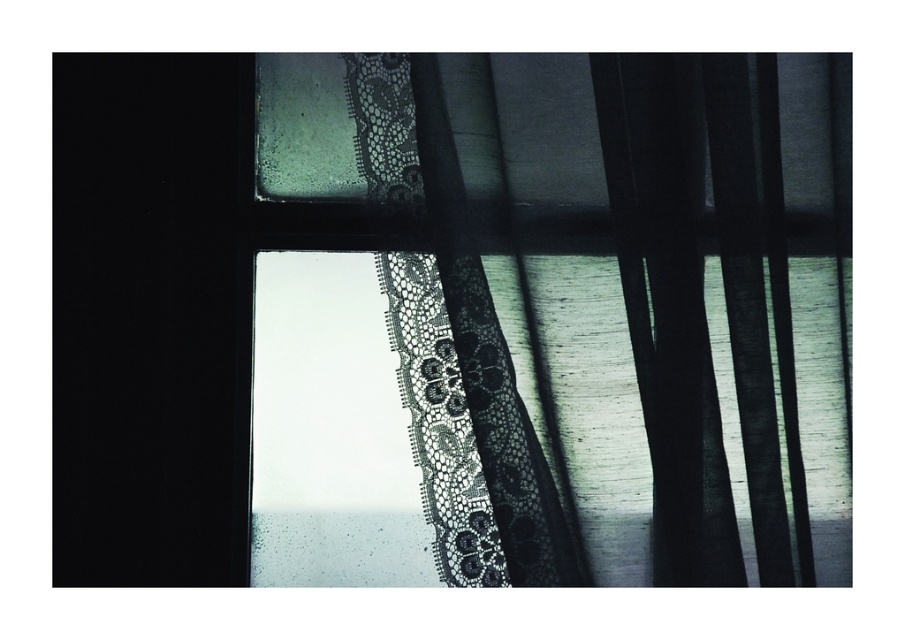
You are an interior designer planning to replace the black lace curtain at upper center and the black matte door at left with new items. If you want to maintain the balance of the room, which object should you choose to make larger? Please consider their current sizes as described.

The black lace curtain at upper center is larger in size than the black matte door at left. To maintain balance, you should make the black matte door at left larger to match the scale of the black lace curtain at upper center.

You are an interior designer trying to place a decorative mirror on the wall. The mirror has a width of 0.4 meters. You want to position it so that it doesn not overlap with the black lace curtain at upper center. Given that the wall is 1.5 meters wide, what is the minimum distance in meters from the left edge of the wall where you can place the mirror without overlapping?

The black lace curtain at upper center is located at point 0.494 on the horizontal axis. To avoid overlapping, the mirror must be placed either to the left or right of this position. The mirror is 0.4 meters wide. The wall is 1.5 meters wide. The minimum distance from the left edge would be 0.494 minus half the mirror width to ensure no overlap. Calculating half the mirror width gives 0.2 meters. Subtracting this from the curtain position gives 0.494m minus 0.2m equals 0.294m. Alternatively, placing the mir

You are standing in front of a window with a dark lace curtain. You notice two points marked on the window frame. The first point is at coordinates point (369, 492) and the second point is at point (134, 52). Which point is closer to you?

Point (369, 492) is further to the viewer than point (134, 52), so the second point is closer to you.